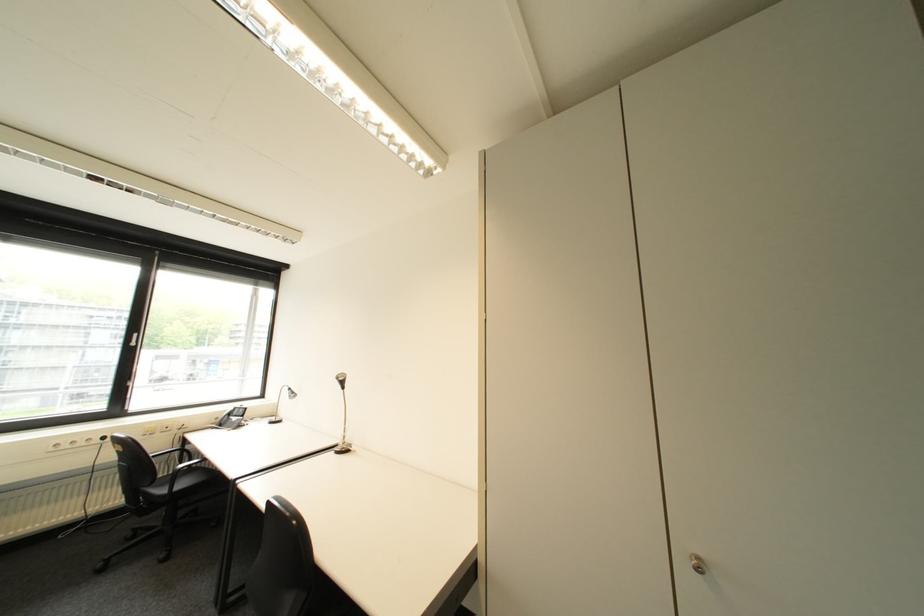
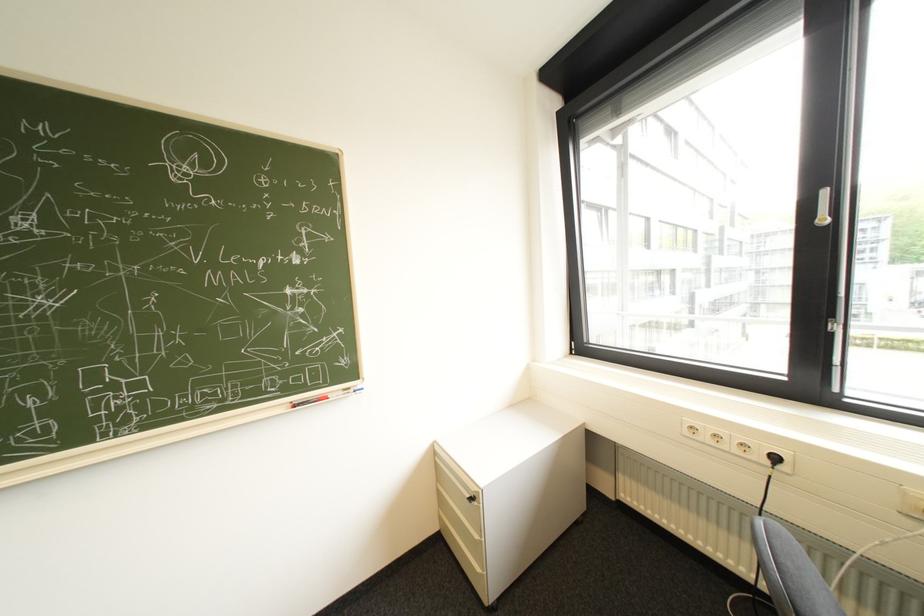
The point at [76,447] is marked in the first image. Where is the corresponding point in the second image?

(715, 438)